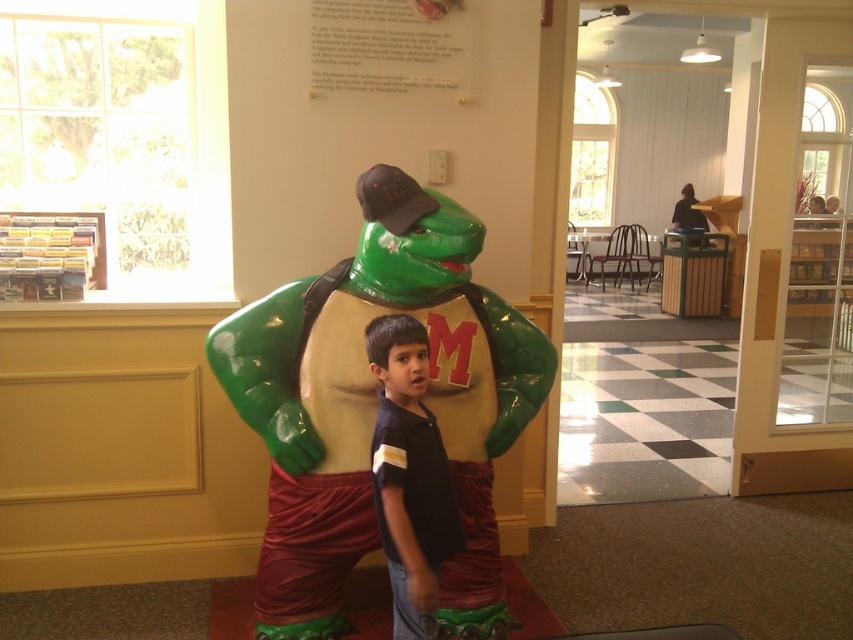
Does glossy plastic turtle at center lie behind black cotton shirt at center?

That is True.

In the scene shown: How far apart are glossy plastic turtle at center and black cotton shirt at center?

They are 10.82 inches apart.

Describe the element at coordinates (376, 404) in the screenshot. I see `glossy plastic turtle at center` at that location.

Image resolution: width=853 pixels, height=640 pixels. I want to click on glossy plastic turtle at center, so click(376, 404).